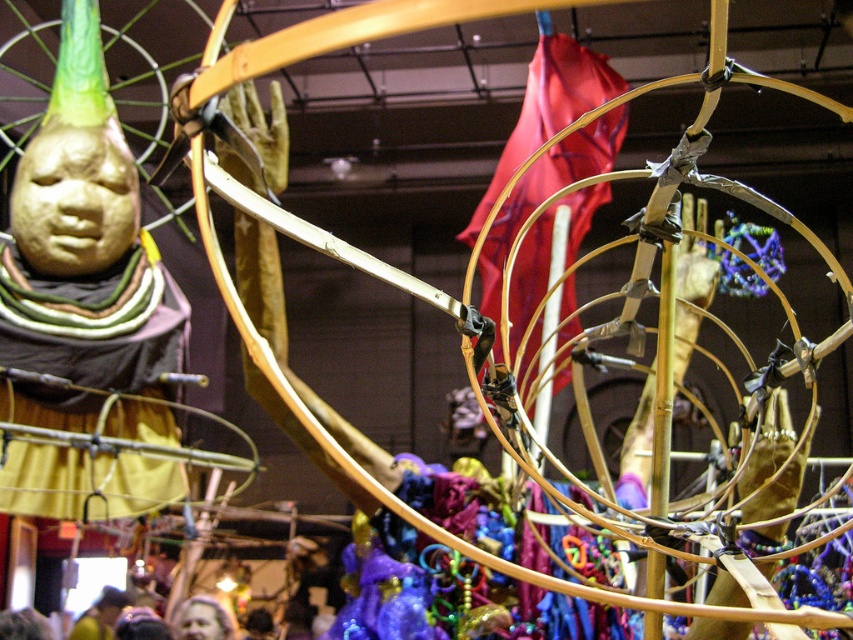
Question: Does smooth skin face at lower center appear under yellow fabric at lower left?

Choices:
 (A) yes
 (B) no

Answer: (B)

Question: Which point appears closest to the camera in this image?

Choices:
 (A) (210, 605)
 (B) (90, 618)

Answer: (A)

Question: Is smooth skin face at lower center to the right of yellow fabric at lower left from the viewer's perspective?

Choices:
 (A) no
 (B) yes

Answer: (B)

Question: Among these objects, which one is nearest to the camera?

Choices:
 (A) smooth skin face at lower center
 (B) yellow fabric at lower left

Answer: (A)

Question: Does smooth skin face at lower center lie in front of yellow fabric at lower left?

Choices:
 (A) yes
 (B) no

Answer: (A)